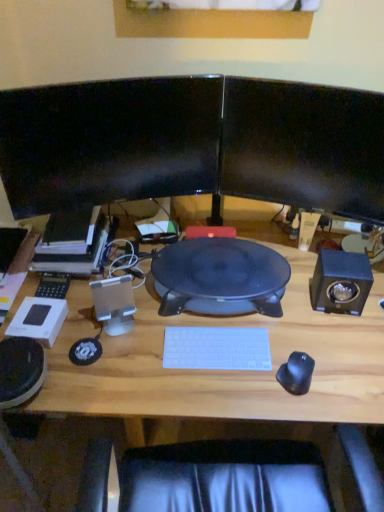
Locate an element on the screen. This screenshot has width=384, height=512. free area in between satin black speaker at right, which ranks as the 1th speaker in right-to-left order, and white plastic keyboard at center is located at coordinates (276, 324).